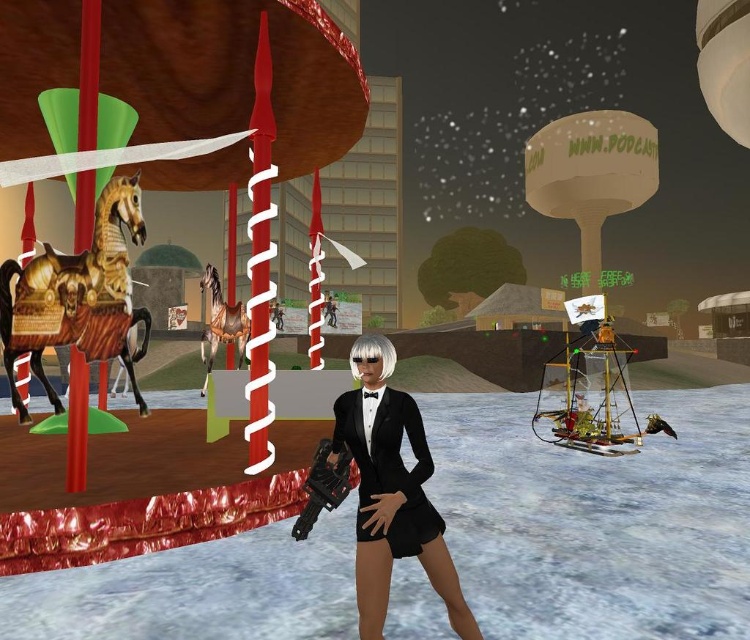
Does black satin dress at center appear on the left side of gold polished wood horse at left?

No, black satin dress at center is not to the left of gold polished wood horse at left.

Is point (432, 564) farther from camera compared to point (141, 401)?

No, (432, 564) is in front of (141, 401).

You are a GUI agent. You are given a task and a screenshot of the screen. Output one action in this format:
    pyautogui.click(x=<x>, y=<y>)
    Task: Click on the black satin dress at center
    The image size is (750, 640).
    Given the screenshot: What is the action you would take?
    pyautogui.click(x=392, y=490)

In order to click on black satin dress at center in this screenshot , I will do `click(392, 490)`.

Which of these two, black satin dress at center or golden polished wood horse at left, stands shorter?

Standing shorter between the two is golden polished wood horse at left.

What do you see at coordinates (392, 490) in the screenshot?
I see `black satin dress at center` at bounding box center [392, 490].

This screenshot has width=750, height=640. What are the coordinates of `black satin dress at center` in the screenshot? It's located at (392, 490).

What do you see at coordinates (392, 490) in the screenshot? I see `black satin dress at center` at bounding box center [392, 490].

Who is more distant from viewer, (369, 348) or (396, 483)?

The point (369, 348) is behind.

Who is more distant from viewer, [368,372] or [376,484]?

Point [368,372]

This screenshot has width=750, height=640. Identify the location of black satin dress at center. (392, 490).